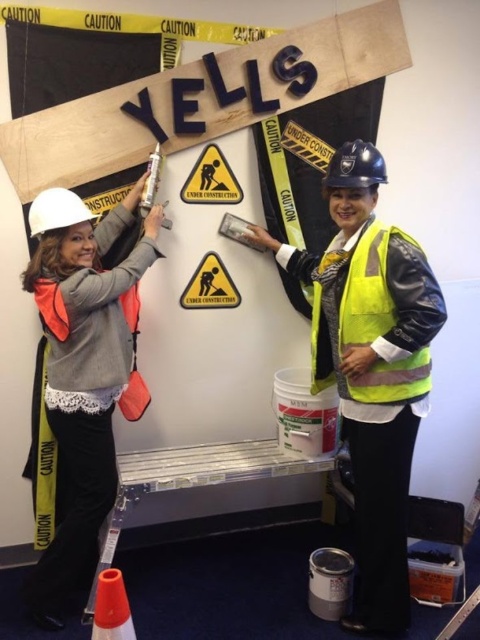
Question: Which object is the farthest from the yellow reflective vest at center?

Choices:
 (A) yellowmaterial/texturewarning sign at center
 (B) white matte hard hat at left
 (C) yellow paper triangle at center
 (D) orange reflective cone at lower left

Answer: (D)

Question: Is white matte hard hat at left wider than orange reflective cone at lower left?

Choices:
 (A) yes
 (B) no

Answer: (A)

Question: Which point appears closest to the camera in this image?

Choices:
 (A) [x=381, y=381]
 (B) [x=115, y=472]
 (C) [x=232, y=304]
 (D) [x=109, y=596]

Answer: (D)

Question: Is yellow reflective safety vest at center to the left of yellowmaterial/texturewarning sign at center from the viewer's perspective?

Choices:
 (A) yes
 (B) no

Answer: (B)

Question: Which point is farther to the camera?

Choices:
 (A) (408, 374)
 (B) (103, 589)
 (C) (206, 292)

Answer: (C)

Question: Is yellow reflective vest at center closer to the viewer compared to orange reflective cone at lower left?

Choices:
 (A) no
 (B) yes

Answer: (A)